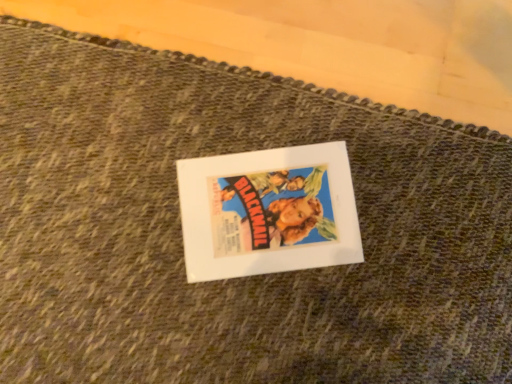
I want to click on free location above white paper at center (from a real-world perspective), so click(271, 209).